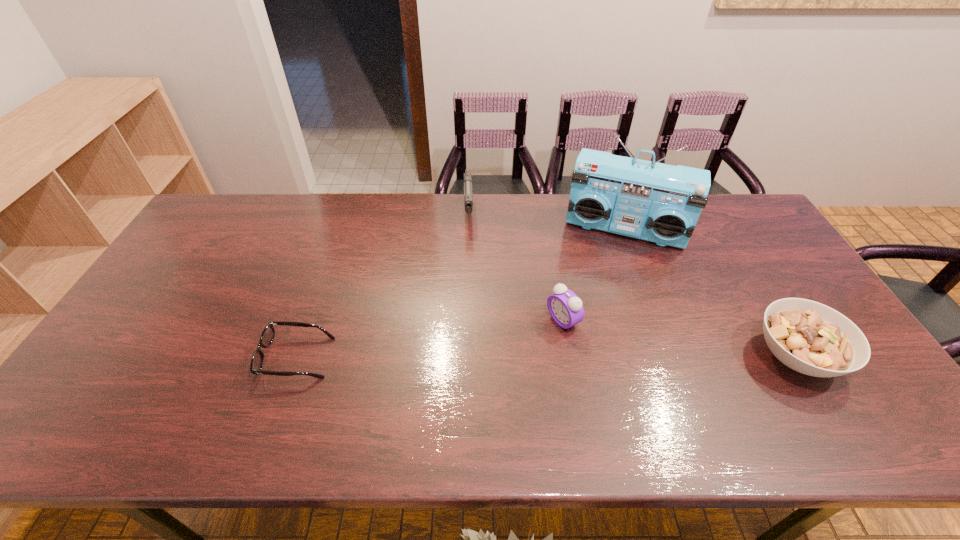
The height and width of the screenshot is (540, 960). What are the coordinates of `radio receiver present at the far edge` in the screenshot? It's located at (661, 204).

The height and width of the screenshot is (540, 960). What are the coordinates of `spectacles that is at the near edge` in the screenshot? It's located at (268, 334).

Where is `stew located in the near edge section of the desktop`? The image size is (960, 540). stew located in the near edge section of the desktop is located at coordinates (809, 337).

You are a GUI agent. You are given a task and a screenshot of the screen. Output one action in this format:
    pyautogui.click(x=<x>, y=<y>)
    Task: Click on the object located in the right edge section of the desktop
    Image resolution: width=960 pixels, height=540 pixels.
    Given the screenshot: What is the action you would take?
    pyautogui.click(x=809, y=337)

You are a GUI agent. You are given a task and a screenshot of the screen. Output one action in this format:
    pyautogui.click(x=<x>, y=<y>)
    Task: Click on the object that is at the near right corner
    Image resolution: width=960 pixels, height=540 pixels.
    Given the screenshot: What is the action you would take?
    pyautogui.click(x=809, y=337)

You are a GUI agent. You are given a task and a screenshot of the screen. Output one action in this format:
    pyautogui.click(x=<x>, y=<y>)
    Task: Click on the free space at the far edge
    Image resolution: width=960 pixels, height=540 pixels.
    Given the screenshot: What is the action you would take?
    pyautogui.click(x=423, y=199)

You are a GUI agent. You are given a task and a screenshot of the screen. Output one action in this format:
    pyautogui.click(x=<x>, y=<y>)
    Task: Click on the vacant space at the near edge
    
    Given the screenshot: What is the action you would take?
    pyautogui.click(x=545, y=376)

Locate an element on the screen. Image resolution: width=960 pixels, height=540 pixels. vacant space at the left edge of the desktop is located at coordinates (216, 261).

Locate an element on the screen. blank space at the far left corner is located at coordinates (243, 227).

Where is `vacant space that is in between the gun and the leftmost object`? The image size is (960, 540). vacant space that is in between the gun and the leftmost object is located at coordinates (383, 285).